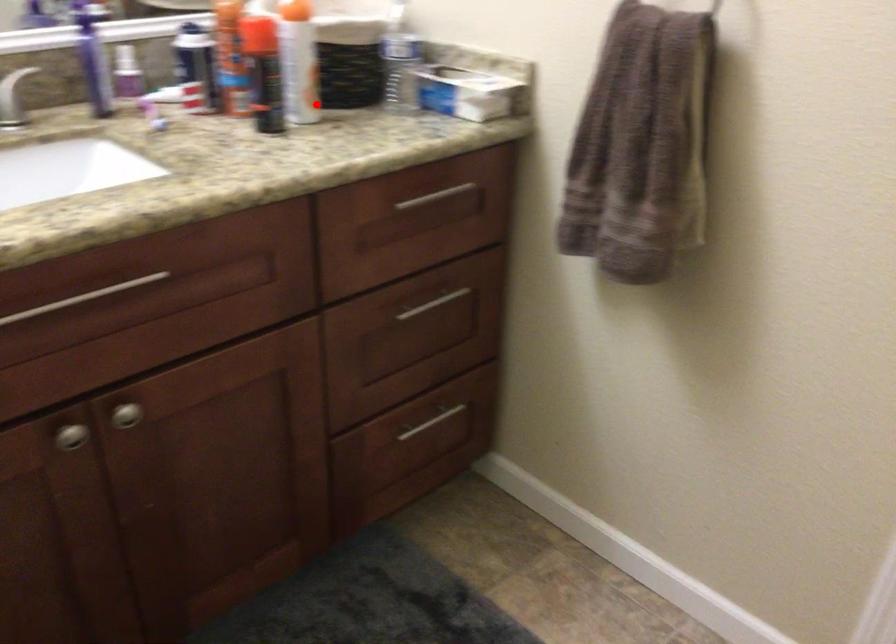
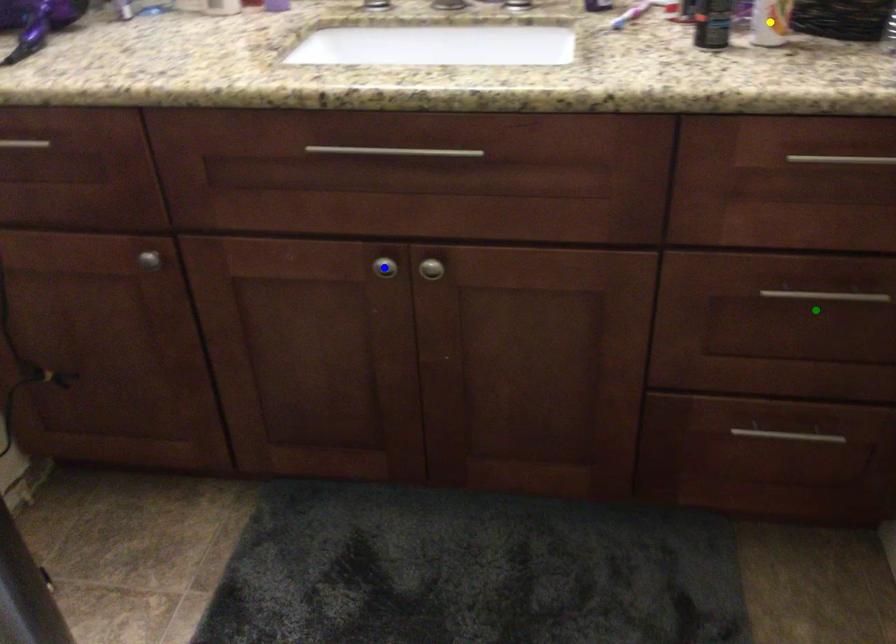
Question: I am providing you with two images of the same scene from different viewpoints. A red point is marked on the first image. You are given multiple points on the second image. Which mark in image 2 goes with the point in image 1?

Choices:
 (A) blue point
 (B) green point
 (C) yellow point

Answer: (C)